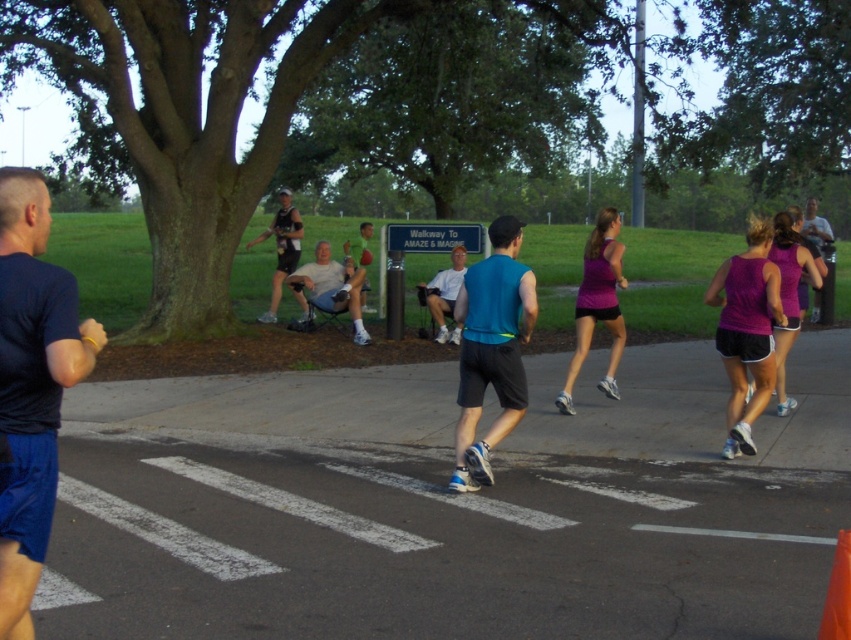
Can you confirm if dark blue fabric shirt at left is taller than light blue fabric shirt at center?

Indeed, dark blue fabric shirt at left has a greater height compared to light blue fabric shirt at center.

Is point (60, 358) closer to camera compared to point (447, 282)?

That is True.

Identify the location of dark blue fabric shirt at left. The width and height of the screenshot is (851, 640). (31, 385).

Does purple matte tank top at center have a greater width compared to matte purple tank top at center?

No.

Which is behind, point (590, 324) or point (827, 240)?

Point (827, 240)

The height and width of the screenshot is (640, 851). What do you see at coordinates (597, 305) in the screenshot?
I see `purple matte tank top at center` at bounding box center [597, 305].

At what (x,y) coordinates should I click in order to perform the action: click on purple matte tank top at center. Please return your answer as a coordinate pair (x, y). Image resolution: width=851 pixels, height=640 pixels. Looking at the image, I should click on (597, 305).

Can you confirm if purple fabric tank top at right is smaller than matte blue shirt at center?

Indeed, purple fabric tank top at right has a smaller size compared to matte blue shirt at center.

Is purple fabric tank top at right to the right of matte blue shirt at center from the viewer's perspective?

Yes, purple fabric tank top at right is to the right of matte blue shirt at center.

Is point (790, 404) farther from camera compared to point (324, 291)?

No.

Image resolution: width=851 pixels, height=640 pixels. I want to click on purple fabric tank top at right, so click(x=787, y=296).